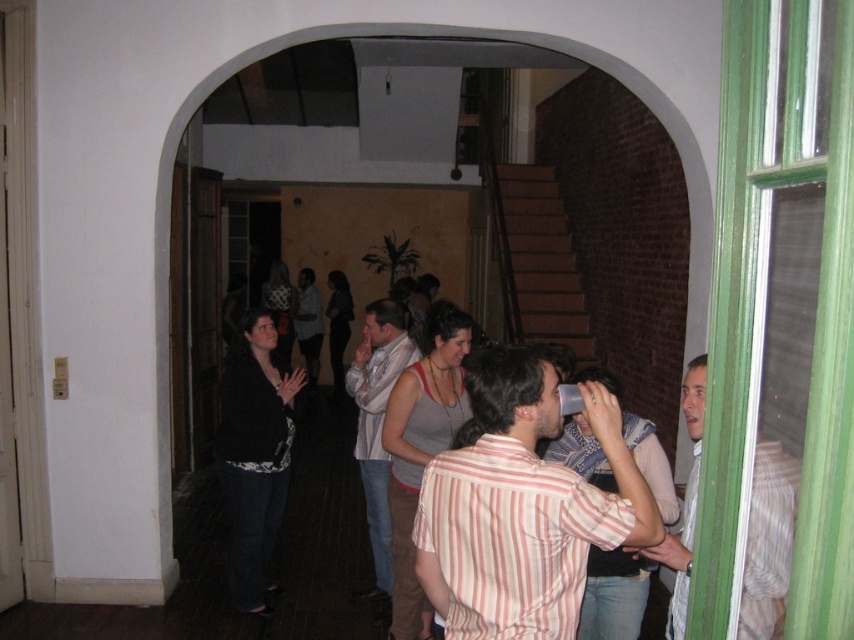
Question: Can you confirm if striped cotton shirt at center is positioned to the right of light brown striped shirt at right?

Choices:
 (A) no
 (B) yes

Answer: (A)

Question: Based on their relative distances, which object is nearer to the striped cotton shirt at center?

Choices:
 (A) light brown striped shirt at right
 (B) light gray scarf at center

Answer: (A)

Question: From the image, what is the correct spatial relationship of striped cotton shirt at center in relation to light gray scarf at center?

Choices:
 (A) above
 (B) below

Answer: (A)

Question: Observing the image, what is the correct spatial positioning of striped cotton shirt at center in reference to light gray scarf at center?

Choices:
 (A) below
 (B) above

Answer: (B)

Question: Among these objects, which one is farthest from the camera?

Choices:
 (A) light brown striped shirt at right
 (B) light gray scarf at center

Answer: (B)

Question: Which object is closer to the camera taking this photo?

Choices:
 (A) light gray scarf at center
 (B) striped cotton shirt at center
 (C) light brown striped shirt at right

Answer: (C)